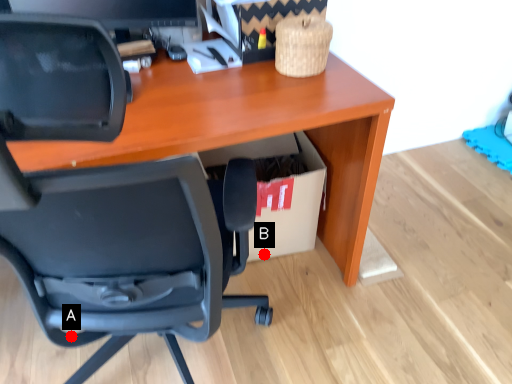
Question: Two points are circled on the image, labeled by A and B beside each circle. Which point is closer to the camera?

Choices:
 (A) A is closer
 (B) B is closer

Answer: (A)